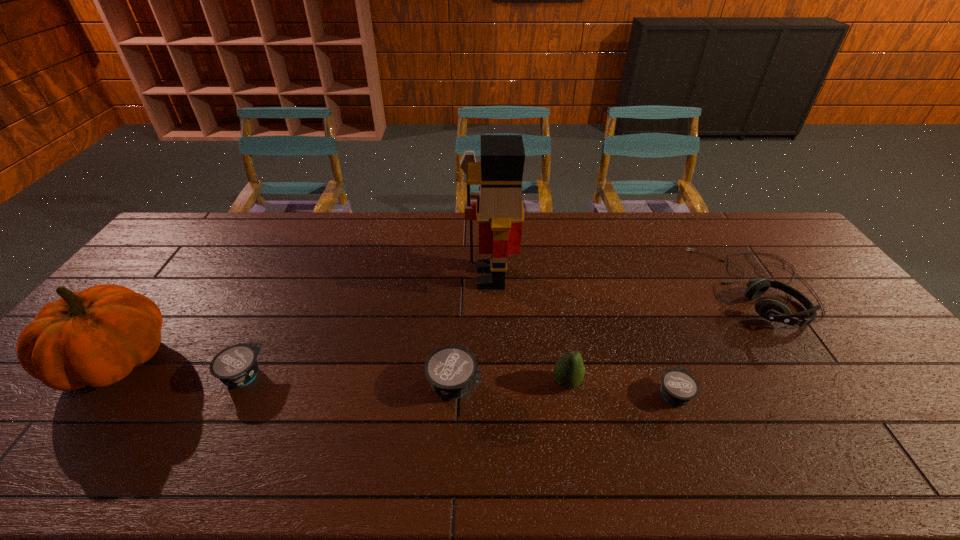
This screenshot has height=540, width=960. What are the coordinates of `the sixth tallest object` in the screenshot? It's located at (236, 366).

Image resolution: width=960 pixels, height=540 pixels. Find the location of `the second shortest yogurt`. the second shortest yogurt is located at coordinates (236, 366).

This screenshot has height=540, width=960. In order to click on the fifth tallest object in this screenshot , I will do `click(452, 370)`.

Where is `the second yogurt from left to right`? Image resolution: width=960 pixels, height=540 pixels. the second yogurt from left to right is located at coordinates (452, 370).

At what (x,y) coordinates should I click in order to perform the action: click on the rightmost yogurt. Please return your answer as a coordinate pair (x, y). Looking at the image, I should click on (678, 387).

Locate an element on the screen. Image resolution: width=960 pixels, height=540 pixels. the second object from right to left is located at coordinates (678, 387).

At what (x,y) coordinates should I click in order to perform the action: click on the fifth object from left to right. Please return your answer as a coordinate pair (x, y). Looking at the image, I should click on (569, 370).

You are a GUI agent. You are given a task and a screenshot of the screen. Output one action in this format:
    pyautogui.click(x=<x>, y=<y>)
    Task: Click on the nutcracker
    The width and height of the screenshot is (960, 540).
    Given the screenshot: What is the action you would take?
    pyautogui.click(x=499, y=209)

I want to click on the second tallest object, so click(95, 337).

The height and width of the screenshot is (540, 960). Identify the location of pumpkin. (95, 337).